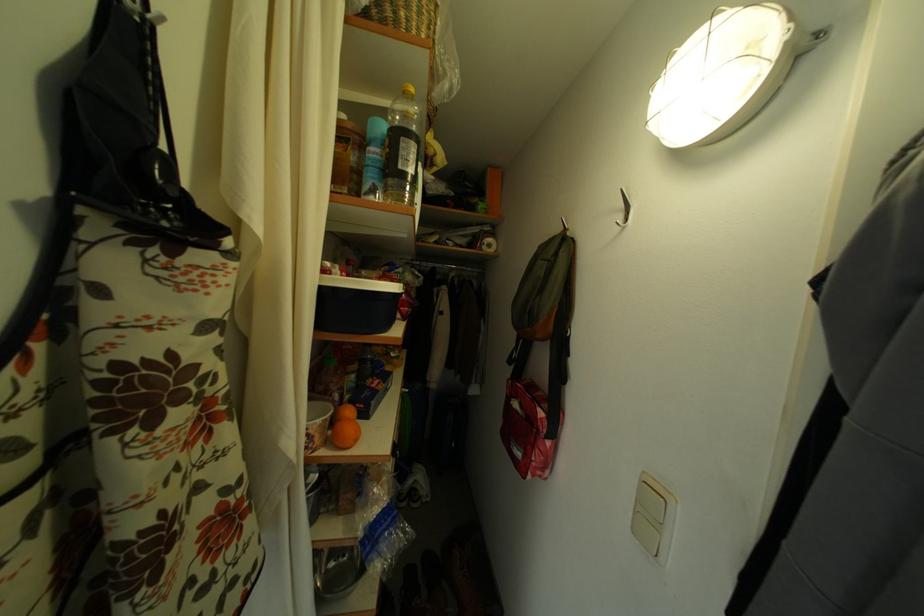
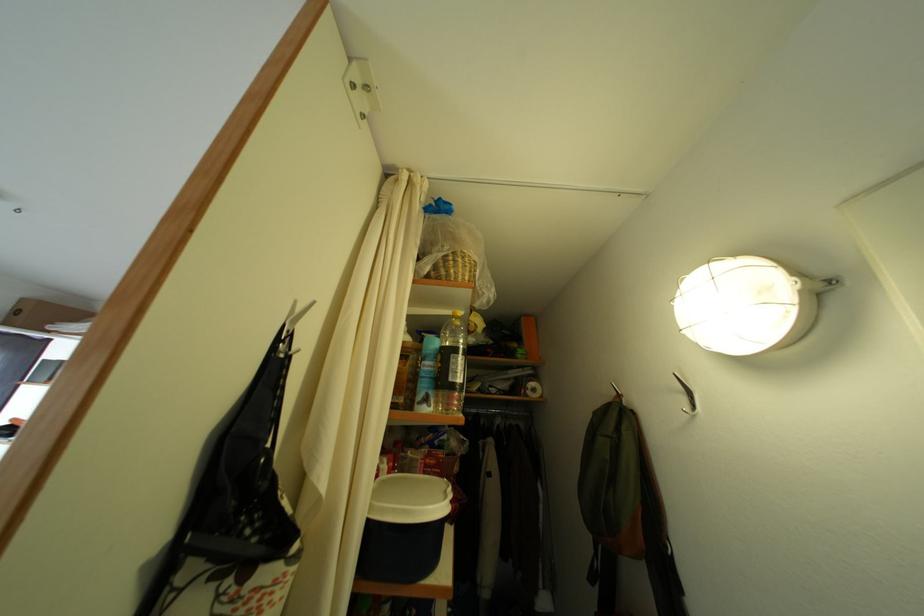
In the second image, find the point that corresponds to point (374, 201) in the first image.

(428, 410)